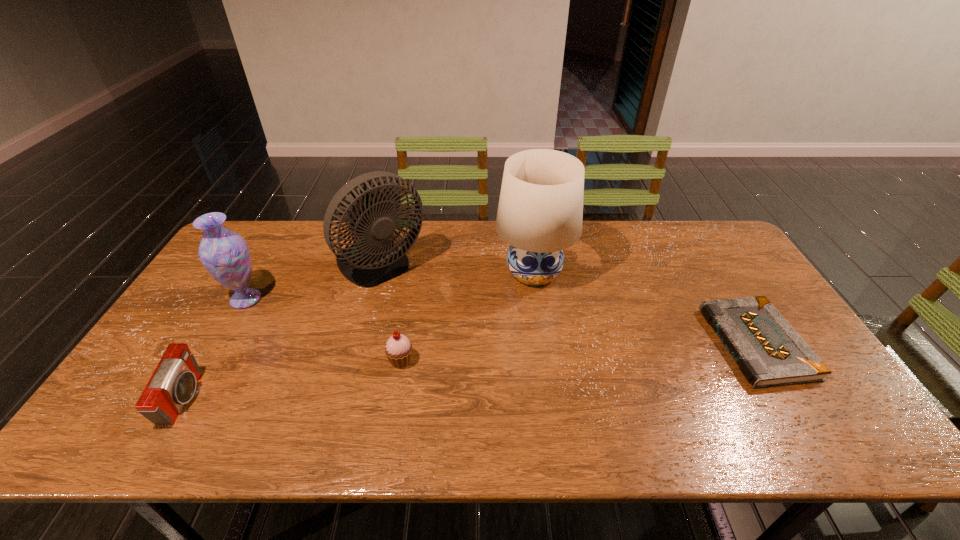
Locate an element on the screen. The image size is (960, 540). vacant point that satisfies the following two spatial constraints: 1. on the front side of the notebook; 2. on the front-facing side of the camera is located at coordinates (790, 399).

The height and width of the screenshot is (540, 960). Find the location of `free space that satisfies the following two spatial constraints: 1. on the front-facing side of the lampshade; 2. on the left side of the shortest object`. free space that satisfies the following two spatial constraints: 1. on the front-facing side of the lampshade; 2. on the left side of the shortest object is located at coordinates coord(543,343).